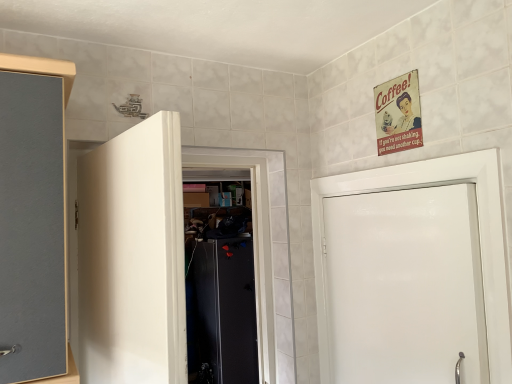
Describe the element at coordinates (479, 231) in the screenshot. I see `white glossy door at right, positioned as the first door in right-to-left order` at that location.

Measure the distance between white glossy door at right, positioned as the first door in right-to-left order, and camera.

A distance of 3.38 feet exists between white glossy door at right, positioned as the first door in right-to-left order, and camera.

Based on the photo, measure the distance between point (501, 357) and camera.

The distance of point (501, 357) from camera is 3.47 feet.

Where is `white glossy door at right, positioned as the first door in right-to-left order`? The width and height of the screenshot is (512, 384). white glossy door at right, positioned as the first door in right-to-left order is located at coordinates pyautogui.click(x=479, y=231).

What is the approximate width of white glossy door at right, the second door viewed from the left?

It is 5.56 inches.

This screenshot has width=512, height=384. I want to click on white matte door at center, marked as the first door in a left-to-right arrangement, so click(133, 257).

The width and height of the screenshot is (512, 384). Describe the element at coordinates (133, 257) in the screenshot. I see `white matte door at center, which ranks as the 2th door in right-to-left order` at that location.

Measure the distance between white matte door at center, which ranks as the 2th door in right-to-left order, and camera.

The depth of white matte door at center, which ranks as the 2th door in right-to-left order, is 34.69 inches.

This screenshot has height=384, width=512. Find the location of `white glossy door at right, positioned as the first door in right-to-left order`. white glossy door at right, positioned as the first door in right-to-left order is located at coordinates (479, 231).

Can you confirm if white matte door at center, which ranks as the 2th door in right-to-left order, is positioned to the right of white glossy door at right, the second door viewed from the left?

In fact, white matte door at center, which ranks as the 2th door in right-to-left order, is to the left of white glossy door at right, the second door viewed from the left.

Is the position of white matte door at center, which ranks as the 2th door in right-to-left order, more distant than that of white glossy door at right, the second door viewed from the left?

No, white matte door at center, which ranks as the 2th door in right-to-left order, is closer to the viewer.

Is point (138, 373) closer or farther from the camera than point (462, 157)?

Point (138, 373) appears to be closer to the viewer than point (462, 157).

Based on the photo, from the image's perspective, which is below, white matte door at center, which ranks as the 2th door in right-to-left order, or white glossy door at right, positioned as the first door in right-to-left order?

From the image's view, white glossy door at right, positioned as the first door in right-to-left order, is below.

From a real-world perspective, is white matte door at center, marked as the first door in a left-to-right arrangement, physically below white glossy door at right, the second door viewed from the left?

No, from a real-world perspective, white matte door at center, marked as the first door in a left-to-right arrangement, is not below white glossy door at right, the second door viewed from the left.

Considering the relative sizes of white matte door at center, which ranks as the 2th door in right-to-left order, and white glossy door at right, the second door viewed from the left, in the image provided, is white matte door at center, which ranks as the 2th door in right-to-left order, thinner than white glossy door at right, the second door viewed from the left,?

No.

Is white matte door at center, which ranks as the 2th door in right-to-left order, taller or shorter than white glossy door at right, the second door viewed from the left?

Considering their sizes, white matte door at center, which ranks as the 2th door in right-to-left order, has less height than white glossy door at right, the second door viewed from the left.

Is white matte door at center, marked as the first door in a left-to-right arrangement, bigger than white glossy door at right, the second door viewed from the left?

Correct, white matte door at center, marked as the first door in a left-to-right arrangement, is larger in size than white glossy door at right, the second door viewed from the left.

Is white glossy door at right, the second door viewed from the left, surrounded by white matte door at center, which ranks as the 2th door in right-to-left order?

No, white matte door at center, which ranks as the 2th door in right-to-left order, does not contain white glossy door at right, the second door viewed from the left.

Is white matte door at center, which ranks as the 2th door in right-to-left order, not close to white glossy door at right, positioned as the first door in right-to-left order?

No.

Is white matte door at center, which ranks as the 2th door in right-to-left order, positioned with its back to white glossy door at right, the second door viewed from the left?

white matte door at center, which ranks as the 2th door in right-to-left order, is not turned away from white glossy door at right, the second door viewed from the left.

How different are the orientations of white matte door at center, marked as the first door in a left-to-right arrangement, and white glossy door at right, the second door viewed from the left, in degrees?

They differ by 170 degrees in their facing directions.

How much distance is there between white matte door at center, marked as the first door in a left-to-right arrangement, and white glossy door at right, the second door viewed from the left?

white matte door at center, marked as the first door in a left-to-right arrangement, is 32.97 inches from white glossy door at right, the second door viewed from the left.

Where is `door that is behind the white matte door at center, which ranks as the 2th door in right-to-left order`? The width and height of the screenshot is (512, 384). door that is behind the white matte door at center, which ranks as the 2th door in right-to-left order is located at coordinates (479, 231).

Considering the relative positions of white glossy door at right, the second door viewed from the left, and white matte door at center, which ranks as the 2th door in right-to-left order, in the image provided, is white glossy door at right, the second door viewed from the left, to the left or to the right of white matte door at center, which ranks as the 2th door in right-to-left order,?

Based on their positions, white glossy door at right, the second door viewed from the left, is located to the right of white matte door at center, which ranks as the 2th door in right-to-left order.

Considering the relative positions of white glossy door at right, positioned as the first door in right-to-left order, and white matte door at center, which ranks as the 2th door in right-to-left order, in the image provided, is white glossy door at right, positioned as the first door in right-to-left order, behind white matte door at center, which ranks as the 2th door in right-to-left order,?

That is True.

Is point (503, 347) closer to viewer compared to point (142, 147)?

No, it is not.

From the image's perspective, is white glossy door at right, the second door viewed from the left, located above white matte door at center, marked as the first door in a left-to-right arrangement?

No, from the image's perspective, white glossy door at right, the second door viewed from the left, is not on top of white matte door at center, marked as the first door in a left-to-right arrangement.

From a real-world perspective, is white glossy door at right, the second door viewed from the left, located higher than white matte door at center, which ranks as the 2th door in right-to-left order?

No.

Consider the image. Considering the relative sizes of white glossy door at right, the second door viewed from the left, and white matte door at center, marked as the first door in a left-to-right arrangement, in the image provided, is white glossy door at right, the second door viewed from the left, wider than white matte door at center, marked as the first door in a left-to-right arrangement,?

Incorrect, the width of white glossy door at right, the second door viewed from the left, does not surpass that of white matte door at center, marked as the first door in a left-to-right arrangement.

Which of these two, white glossy door at right, the second door viewed from the left, or white matte door at center, which ranks as the 2th door in right-to-left order, stands shorter?

With less height is white matte door at center, which ranks as the 2th door in right-to-left order.

Does white glossy door at right, the second door viewed from the left, have a smaller size compared to white matte door at center, marked as the first door in a left-to-right arrangement?

Correct, white glossy door at right, the second door viewed from the left, occupies less space than white matte door at center, marked as the first door in a left-to-right arrangement.

Would you say white glossy door at right, positioned as the first door in right-to-left order, is outside white matte door at center, which ranks as the 2th door in right-to-left order?

white glossy door at right, positioned as the first door in right-to-left order, lies outside white matte door at center, which ranks as the 2th door in right-to-left order,'s area.

Are white glossy door at right, the second door viewed from the left, and white matte door at center, marked as the first door in a left-to-right arrangement, located far from each other?

No, white glossy door at right, the second door viewed from the left, is in close proximity to white matte door at center, marked as the first door in a left-to-right arrangement.

Is white glossy door at right, positioned as the first door in right-to-left order, turned away from white matte door at center, marked as the first door in a left-to-right arrangement?

No, white glossy door at right, positioned as the first door in right-to-left order, is not facing away from white matte door at center, marked as the first door in a left-to-right arrangement.

Based on the photo, how many degrees apart are the facing directions of white glossy door at right, positioned as the first door in right-to-left order, and white matte door at center, which ranks as the 2th door in right-to-left order?

The facing directions of white glossy door at right, positioned as the first door in right-to-left order, and white matte door at center, which ranks as the 2th door in right-to-left order, are 170 degrees apart.

How distant is white glossy door at right, the second door viewed from the left, from white matte door at center, which ranks as the 2th door in right-to-left order?

They are 32.97 inches apart.

You are a GUI agent. You are given a task and a screenshot of the screen. Output one action in this format:
    pyautogui.click(x=<x>, y=<y>)
    Task: Click on the door below the white matte door at center, which ranks as the 2th door in right-to-left order (from the image's perspective)
    The image size is (512, 384).
    Given the screenshot: What is the action you would take?
    pyautogui.click(x=479, y=231)

In the image, there is a white matte door at center, marked as the first door in a left-to-right arrangement. Where is `door below it (from the image's perspective)`? door below it (from the image's perspective) is located at coordinates (479, 231).

What are the coordinates of `door that is above the white glossy door at right, positioned as the first door in right-to-left order (from a real-world perspective)` in the screenshot? It's located at (133, 257).